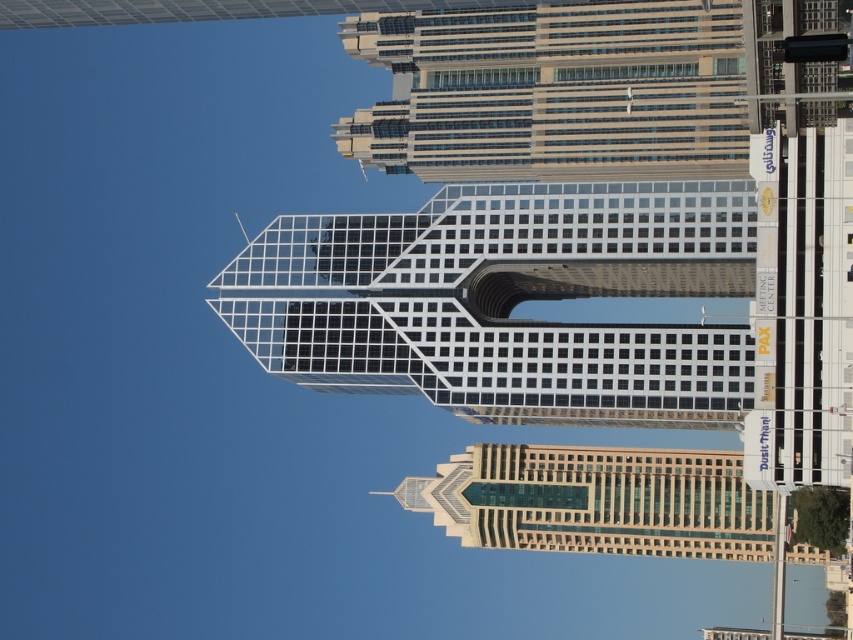
Locate an element on the screen. This screenshot has height=640, width=853. transparent glass tower at center is located at coordinates pyautogui.click(x=508, y=301).

Can you confirm if transparent glass tower at center is taller than glassy steel skyscraper at upper center?

No.

Which is in front, point (727, 403) or point (717, 38)?

Point (727, 403)

Where is `transparent glass tower at center`? Image resolution: width=853 pixels, height=640 pixels. transparent glass tower at center is located at coordinates (508, 301).